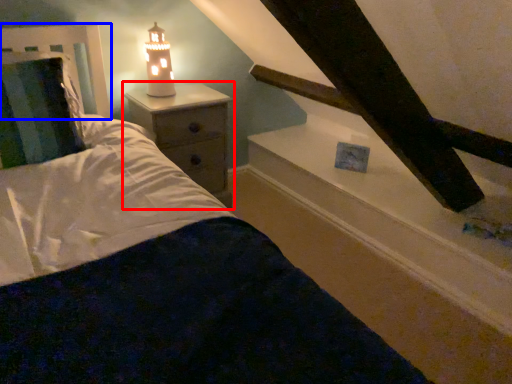
Question: Which object is closer to the camera taking this photo, nightstand (highlighted by a red box) or headboard (highlighted by a blue box)?

Choices:
 (A) nightstand
 (B) headboard

Answer: (B)